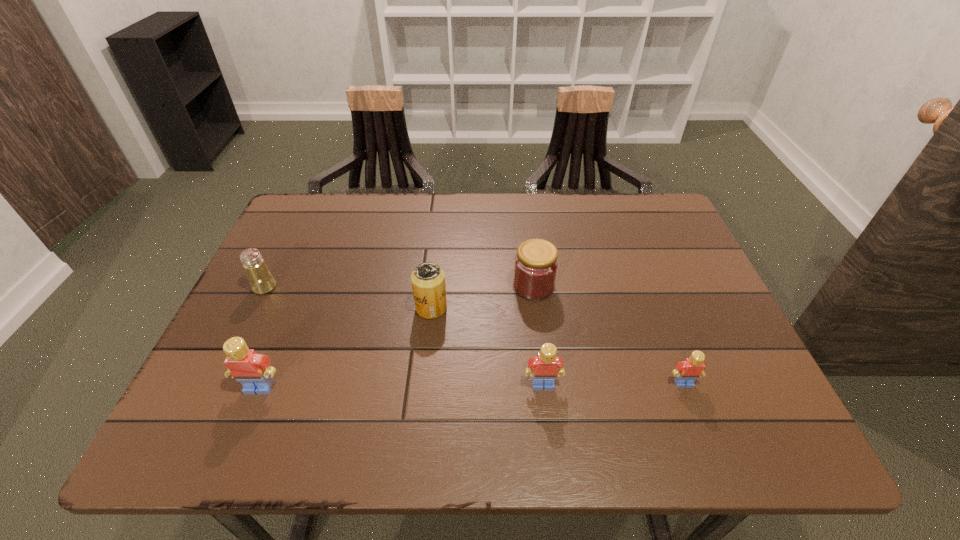
Where is `blank space located on the back of the saltshaker`? This screenshot has width=960, height=540. blank space located on the back of the saltshaker is located at coordinates (285, 246).

This screenshot has width=960, height=540. Find the location of `Lego situated at the left edge`. Lego situated at the left edge is located at coordinates (252, 370).

Identify the location of saltshaker that is at the left edge. The image size is (960, 540). (261, 280).

The width and height of the screenshot is (960, 540). Find the location of `object at the right edge`. object at the right edge is located at coordinates (687, 371).

Identify the location of object present at the near left corner. This screenshot has width=960, height=540. (252, 370).

The width and height of the screenshot is (960, 540). I want to click on object located in the near right corner section of the desktop, so click(687, 371).

I want to click on free spot at the far edge of the desktop, so click(x=568, y=235).

Identify the location of blank space at the near edge of the desktop. (588, 390).

I want to click on vacant space at the left edge of the desktop, so click(x=321, y=263).

In the image, there is a desktop. What are the coordinates of `vacant space at the right edge` in the screenshot? It's located at (687, 287).